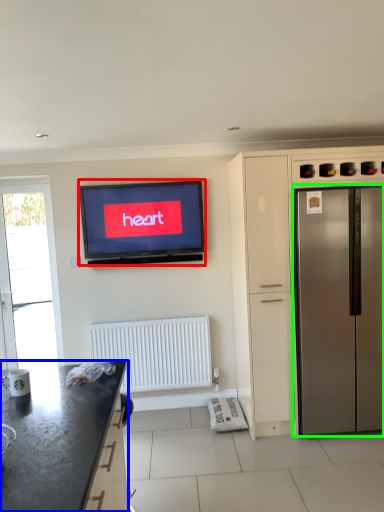
Question: Which object is the farthest from television (highlighted by a red box)? Choose among these: countertop (highlighted by a blue box) or refrigerator (highlighted by a green box).

Choices:
 (A) countertop
 (B) refrigerator

Answer: (A)